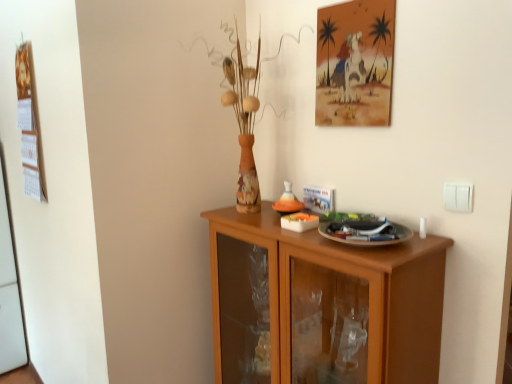
Question: Considering the relative positions of watercolor paper painting at upper center, which is the 1th picture frame in front-to-back order, and white plastic switch at upper right in the image provided, is watercolor paper painting at upper center, which is the 1th picture frame in front-to-back order, to the left of white plastic switch at upper right from the viewer's perspective?

Choices:
 (A) no
 (B) yes

Answer: (B)

Question: Is watercolor paper painting at upper center, which is the second picture frame in left-to-right order, wider than white plastic switch at upper right?

Choices:
 (A) no
 (B) yes

Answer: (B)

Question: Considering the relative sizes of watercolor paper painting at upper center, which is the second picture frame in left-to-right order, and white plastic switch at upper right in the image provided, is watercolor paper painting at upper center, which is the second picture frame in left-to-right order, bigger than white plastic switch at upper right?

Choices:
 (A) yes
 (B) no

Answer: (A)

Question: Is watercolor paper painting at upper center, the 1th picture frame viewed from the right, facing away from white plastic switch at upper right?

Choices:
 (A) no
 (B) yes

Answer: (A)

Question: Could you tell me if watercolor paper painting at upper center, the second picture frame when ordered from back to front, is turned towards white plastic switch at upper right?

Choices:
 (A) yes
 (B) no

Answer: (B)

Question: Is watercolor paper painting at upper center, the 1th picture frame viewed from the right, far away from white plastic switch at upper right?

Choices:
 (A) yes
 (B) no

Answer: (B)

Question: Is white plastic switch at upper right inside brown wooden cabinet at center?

Choices:
 (A) yes
 (B) no

Answer: (B)

Question: Is brown wooden cabinet at center wider than white plastic switch at upper right?

Choices:
 (A) yes
 (B) no

Answer: (A)

Question: Is brown wooden cabinet at center far away from white plastic switch at upper right?

Choices:
 (A) no
 (B) yes

Answer: (A)

Question: Can you confirm if brown wooden cabinet at center is taller than white plastic switch at upper right?

Choices:
 (A) yes
 (B) no

Answer: (A)

Question: From a real-world perspective, is brown wooden cabinet at center physically above white plastic switch at upper right?

Choices:
 (A) no
 (B) yes

Answer: (A)

Question: Is brown wooden cabinet at center to the left of white plastic switch at upper right from the viewer's perspective?

Choices:
 (A) no
 (B) yes

Answer: (B)

Question: Is wooden calendar at left, which is counted as the 1th picture frame, starting from the left, facing towards white plastic switch at upper right?

Choices:
 (A) yes
 (B) no

Answer: (B)